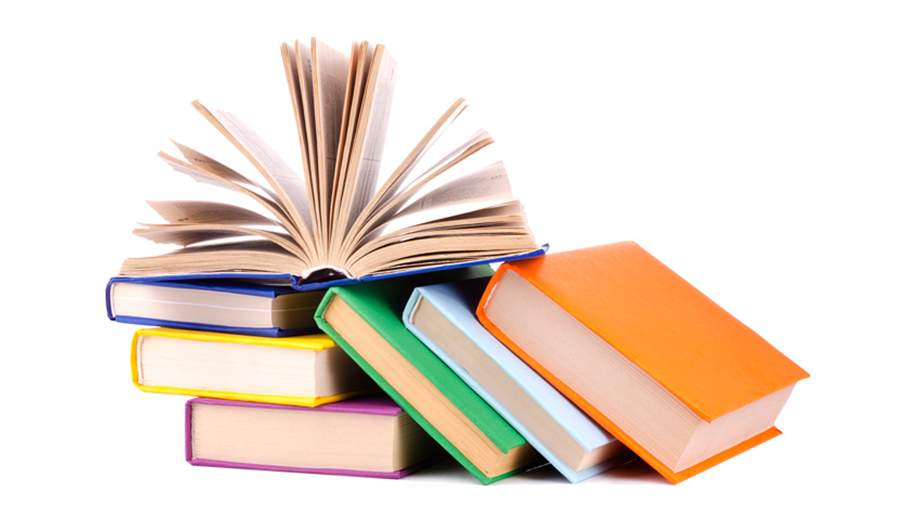
Locate an element on the screen. The width and height of the screenshot is (918, 516). books is located at coordinates (319, 257), (238, 317), (265, 386), (295, 438), (353, 336), (444, 342), (555, 331).